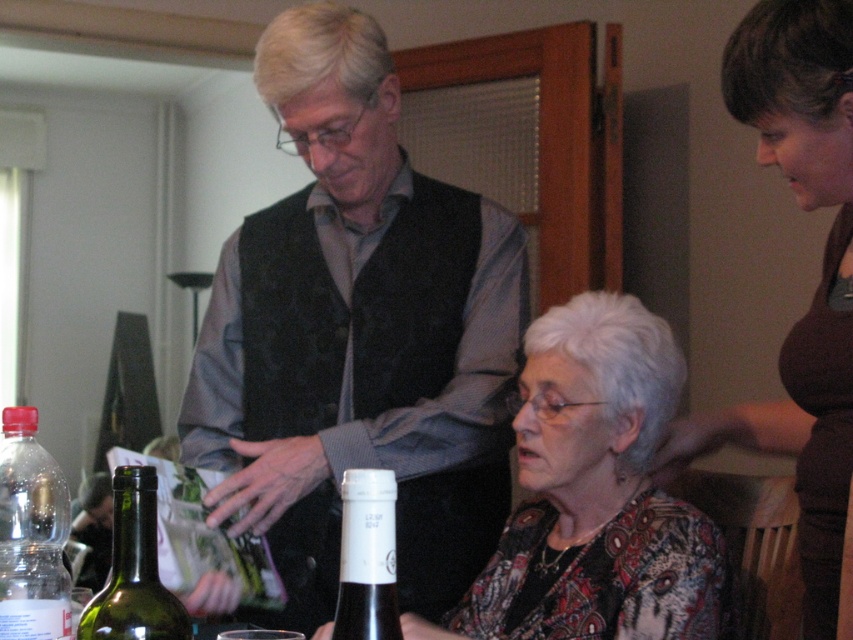
You are a delivery robot that is 0.5 meters wide. You are in a dining area and need to move from the table to the door located behind the older man. The older man is standing at point (x=556, y=576). Can you pass between the seated woman and the older man without hitting either of them?

The distance between the seated woman and the older man at point (x=556, y=576) is 1.51 meters. Since the robot is 0.5 meters wide, there is sufficient space to pass between them safely.

You are a guest at this dinner and need to choose between the transparent plastic bottle at lower left and the black glass wine bottle at lower center for your drink. Which bottle would you pick if you want the one that holds more liquid?

The transparent plastic bottle at lower left is larger in size than the black glass wine bottle at lower center, so it can hold more liquid. Therefore, you should choose the transparent plastic bottle at lower left.